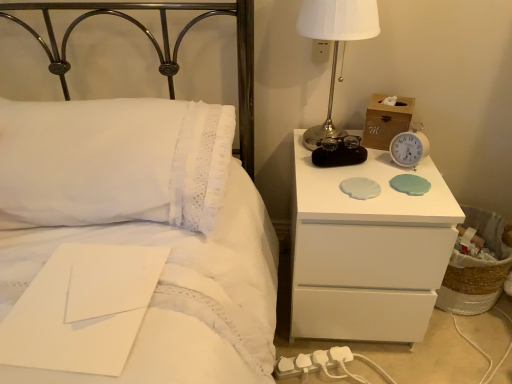
This screenshot has height=384, width=512. I want to click on vacant space situated on the left part of white plastic alarm clock at upper right, the 2th alarm clock viewed from the left, so [x=362, y=173].